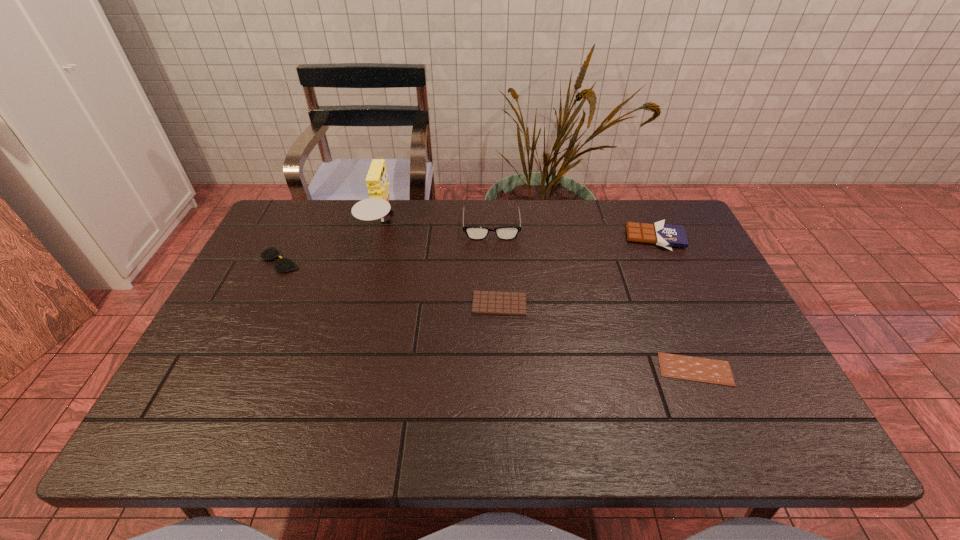
At what (x,y) coordinates should I click in order to perform the action: click on the second object from left to right. Please return your answer as a coordinate pair (x, y). The image size is (960, 540). Looking at the image, I should click on coord(377,206).

Where is `sponge`? This screenshot has width=960, height=540. sponge is located at coordinates (377, 206).

At what (x,y) coordinates should I click in order to perform the action: click on the right spectacles. Please return your answer as a coordinate pair (x, y). Looking at the image, I should click on (473, 232).

At what (x,y) coordinates should I click in order to perform the action: click on the taller spectacles. Please return your answer as a coordinate pair (x, y). The image size is (960, 540). Looking at the image, I should click on (473, 232).

Identify the location of the tallest chocolate bar. (665, 235).

The width and height of the screenshot is (960, 540). What are the coordinates of `the farthest chocolate bar` in the screenshot? It's located at (665, 235).

In order to click on the third shortest object in this screenshot , I will do `click(283, 265)`.

You are a GUI agent. You are given a task and a screenshot of the screen. Output one action in this format:
    pyautogui.click(x=<x>, y=<y>)
    Task: Click on the leftmost object
    Image resolution: width=960 pixels, height=540 pixels.
    Given the screenshot: What is the action you would take?
    283,265

You are a GUI agent. You are given a task and a screenshot of the screen. Output one action in this format:
    pyautogui.click(x=<x>, y=<y>)
    Task: Click on the second farthest chocolate bar
    
    Given the screenshot: What is the action you would take?
    pyautogui.click(x=484, y=302)

Where is `the second tallest chocolate bar`? the second tallest chocolate bar is located at coordinates (484, 302).